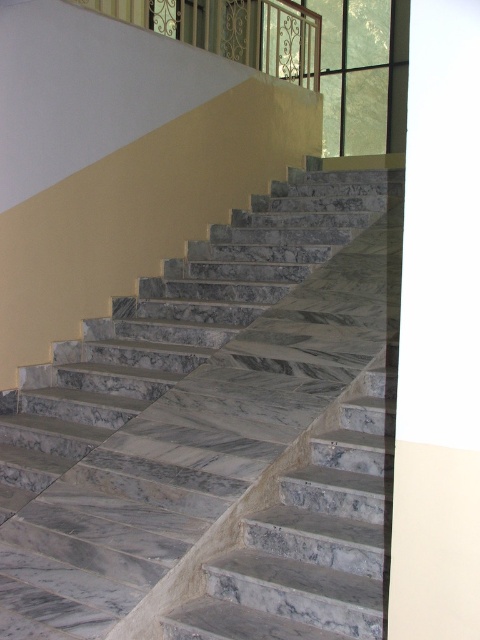
Question: Which point appears closest to the camera in this image?

Choices:
 (A) (233, 232)
 (B) (243, 45)

Answer: (A)

Question: Is marble stairs at center below metallic wrought iron at upper center?

Choices:
 (A) yes
 (B) no

Answer: (A)

Question: Is marble stairs at center to the right of metallic wrought iron at upper center from the viewer's perspective?

Choices:
 (A) yes
 (B) no

Answer: (A)

Question: Which of the following is the closest to the observer?

Choices:
 (A) marble stairs at center
 (B) metallic wrought iron at upper center

Answer: (A)

Question: Which point appears closest to the camera in this image?

Choices:
 (A) (297, 349)
 (B) (179, 17)

Answer: (A)

Question: Is the position of marble stairs at center more distant than that of metallic wrought iron at upper center?

Choices:
 (A) yes
 (B) no

Answer: (B)